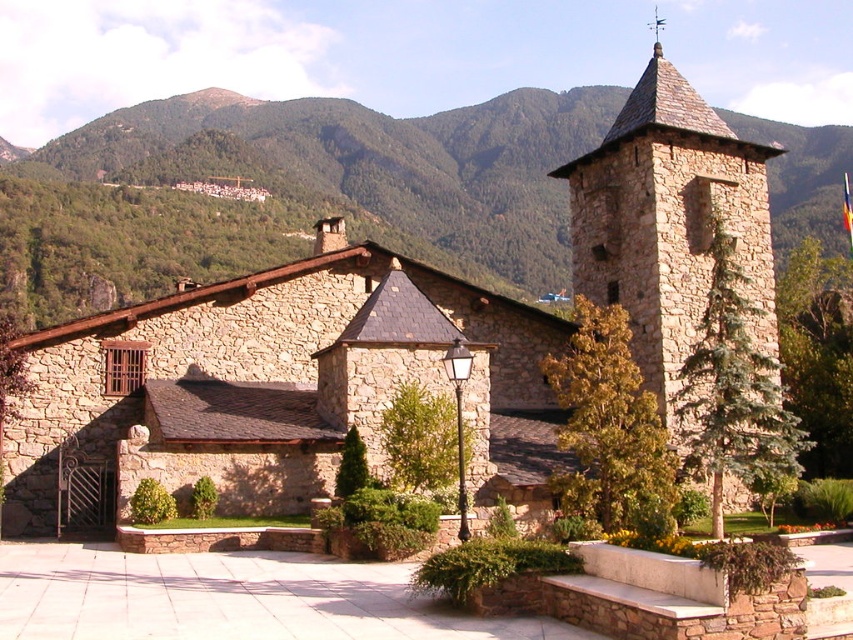
Question: Estimate the real-world distances between objects in this image. Which object is closer to the brown stone church at center?

Choices:
 (A) green leafy hillside at upper left
 (B) stone steeple at upper right

Answer: (B)

Question: Which of the following is the farthest from the observer?

Choices:
 (A) (39, 531)
 (B) (641, 253)
 (C) (503, 211)
 (D) (660, 26)

Answer: (D)

Question: Estimate the real-world distances between objects in this image. Which object is farther from the brown stone church at center?

Choices:
 (A) stone steeple at upper right
 (B) green leafy hillside at upper left

Answer: (B)

Question: Can you confirm if green leafy hillside at upper left is thinner than stone steeple at upper right?

Choices:
 (A) yes
 (B) no

Answer: (B)

Question: Where is brown stone church at center located in relation to polished copper spire at upper center in the image?

Choices:
 (A) below
 (B) above

Answer: (A)

Question: Is stone steeple at upper right positioned behind polished copper spire at upper center?

Choices:
 (A) no
 (B) yes

Answer: (A)